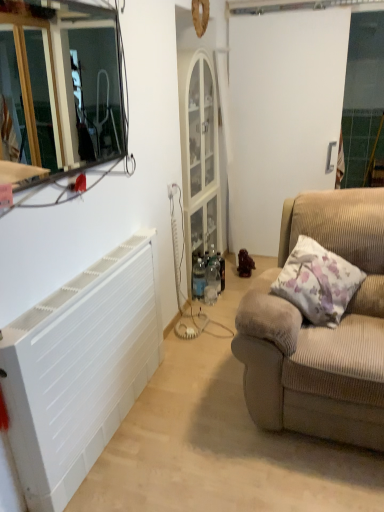
You are a GUI agent. You are given a task and a screenshot of the screen. Output one action in this format:
    pyautogui.click(x=<x>, y=<y>)
    Task: Click on the vacant space underneath metallic glass window frame at upper left (from a real-world perspective)
    The height and width of the screenshot is (512, 384).
    Given the screenshot: What is the action you would take?
    pyautogui.click(x=100, y=265)